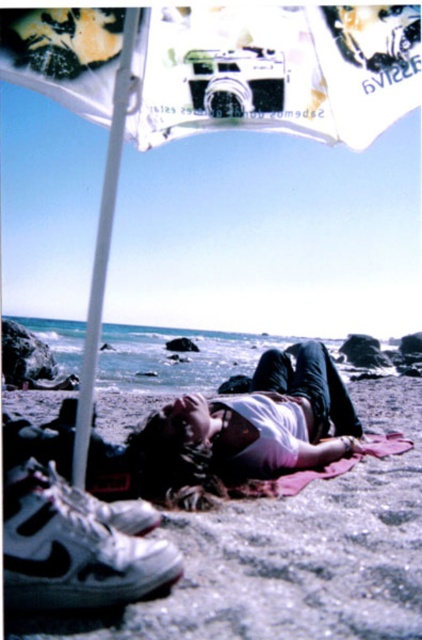
Between smooth sand at lower center and pink fabric at lower center, which one appears on the right side from the viewer's perspective?

From the viewer's perspective, smooth sand at lower center appears more on the right side.

Which is behind, point (413, 436) or point (343, 435)?

The point (413, 436) is more distant.

Is point (262, 580) positioned before point (337, 390)?

That is True.

You are a GUI agent. You are given a task and a screenshot of the screen. Output one action in this format:
    pyautogui.click(x=<x>, y=<y>)
    Task: Click on the smooth sand at lower center
    
    Given the screenshot: What is the action you would take?
    pyautogui.click(x=294, y=554)